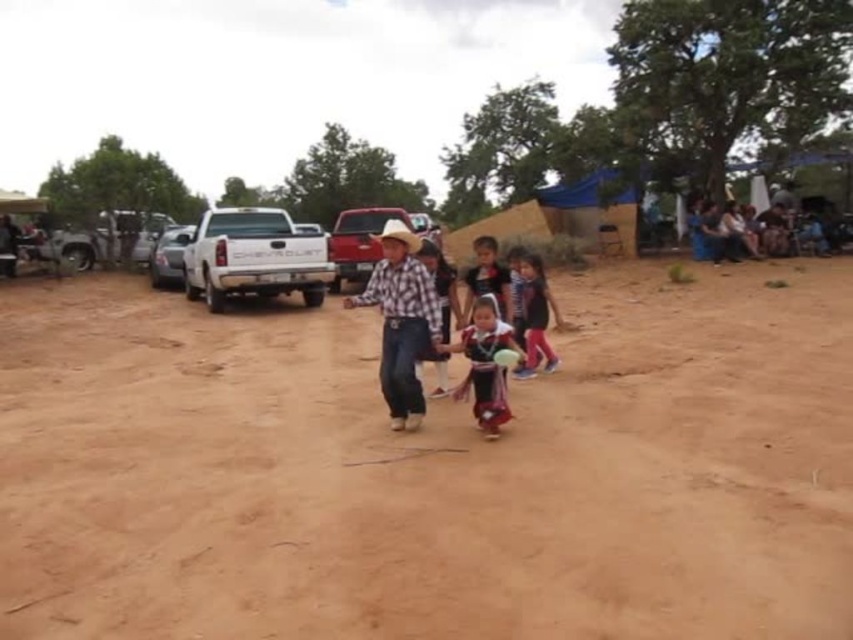
Does brown sandy ground at center come behind dark blue fabric dress at center?

That is False.

Between point (793, 488) and point (538, 340), which one is positioned in front?

Point (793, 488) is more forward.

You are a GUI agent. You are given a task and a screenshot of the screen. Output one action in this format:
    pyautogui.click(x=<x>, y=<y>)
    Task: Click on the brown sandy ground at center
    The image size is (853, 640).
    Given the screenshot: What is the action you would take?
    pyautogui.click(x=428, y=468)

Can you confirm if brown sandy ground at center is wider than plaid fabric shirt at center?

Yes, brown sandy ground at center is wider than plaid fabric shirt at center.

Between brown sandy ground at center and plaid fabric shirt at center, which one is positioned higher?

plaid fabric shirt at center is above.

Where is `brown sandy ground at center`? brown sandy ground at center is located at coordinates (428, 468).

Locate an element on the screen. This screenshot has height=640, width=853. brown sandy ground at center is located at coordinates (428, 468).

Is brown sandy ground at center closer to camera compared to matte black dress at center?

Yes, it is.

Identify the location of brown sandy ground at center. The image size is (853, 640). [428, 468].